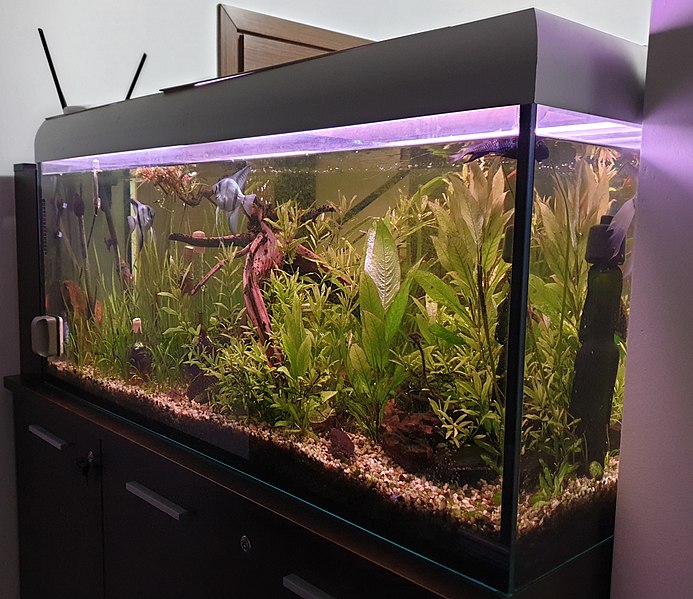
Find the location of a particular element. The image size is (693, 599). cabinet is located at coordinates (211, 543).